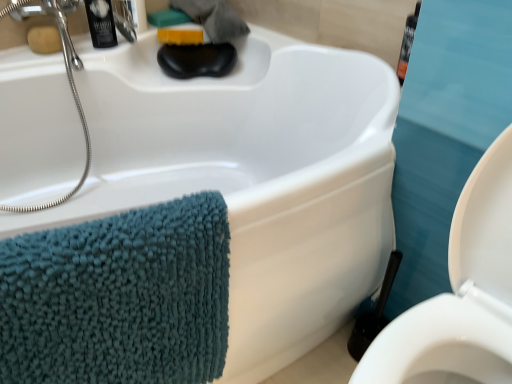
Question: From a real-world perspective, is teal chenille towel at left under matte brown soap at upper left, which is counted as the 2th soap, starting from the right?

Choices:
 (A) yes
 (B) no

Answer: (A)

Question: Is teal chenille towel at left to the left of matte brown soap at upper left, the 2th soap in the back-to-front sequence, from the viewer's perspective?

Choices:
 (A) no
 (B) yes

Answer: (A)

Question: Considering the relative positions of teal chenille towel at left and matte brown soap at upper left, the 2th soap in the back-to-front sequence, in the image provided, is teal chenille towel at left behind matte brown soap at upper left, the 2th soap in the back-to-front sequence,?

Choices:
 (A) yes
 (B) no

Answer: (B)

Question: Is teal chenille towel at left positioned before matte brown soap at upper left, the 2th soap in the back-to-front sequence?

Choices:
 (A) no
 (B) yes

Answer: (B)

Question: Is matte brown soap at upper left, which is counted as the 2th soap, starting from the right, at the back of teal chenille towel at left?

Choices:
 (A) no
 (B) yes

Answer: (B)

Question: Considering the relative positions of black plastic toiletry at upper left and teal chenille towel at left in the image provided, is black plastic toiletry at upper left to the left or to the right of teal chenille towel at left?

Choices:
 (A) left
 (B) right

Answer: (A)

Question: Is black plastic toiletry at upper left inside the boundaries of teal chenille towel at left, or outside?

Choices:
 (A) outside
 (B) inside

Answer: (A)

Question: Considering the positions of black plastic toiletry at upper left and teal chenille towel at left in the image, is black plastic toiletry at upper left bigger or smaller than teal chenille towel at left?

Choices:
 (A) small
 (B) big

Answer: (A)

Question: Is black plastic toiletry at upper left taller or shorter than teal chenille towel at left?

Choices:
 (A) short
 (B) tall

Answer: (A)

Question: From a real-world perspective, is white glossy toilet at lower right positioned above or below matte brown soap at upper left, which is counted as the 2th soap, starting from the right?

Choices:
 (A) above
 (B) below

Answer: (B)

Question: Would you say white glossy toilet at lower right is inside or outside matte brown soap at upper left, the first soap when ordered from left to right?

Choices:
 (A) outside
 (B) inside

Answer: (A)

Question: From the image's perspective, is white glossy toilet at lower right above or below matte brown soap at upper left, the first soap when ordered from left to right?

Choices:
 (A) above
 (B) below

Answer: (B)

Question: Is white glossy toilet at lower right wider or thinner than matte brown soap at upper left, the first soap when ordered from left to right?

Choices:
 (A) thin
 (B) wide

Answer: (B)

Question: In the image, is black plastic toiletry at upper left positioned in front of or behind black plastic toilet brush at lower right?

Choices:
 (A) behind
 (B) front

Answer: (A)

Question: Would you say black plastic toiletry at upper left is inside or outside black plastic toilet brush at lower right?

Choices:
 (A) outside
 (B) inside

Answer: (A)